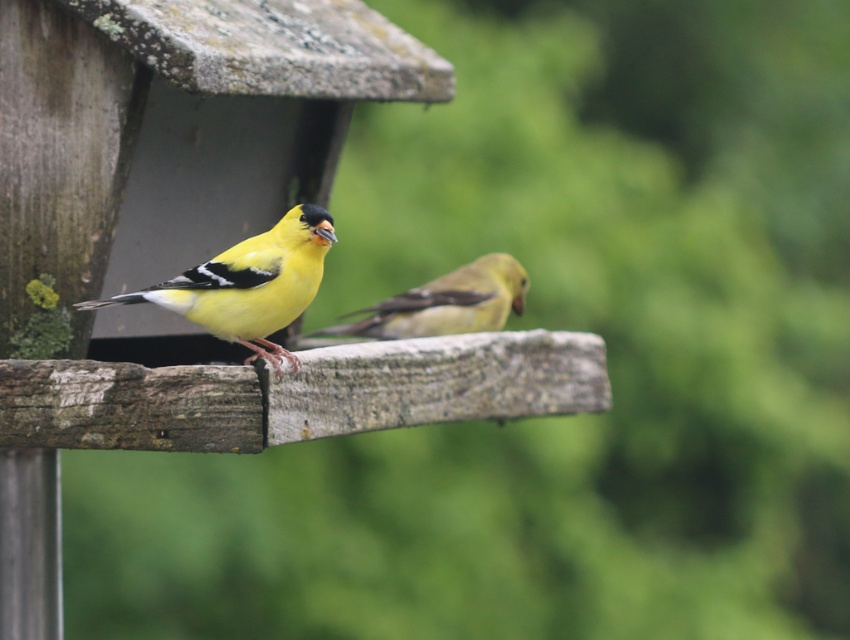
You are a birdwatcher observing the two birds at the wooden structure. The first bird is at point (259, 234) and the second bird is at point (482, 310). Which bird is closer to you?

The bird at point (259, 234) is closer to you because it is in front of the bird at point (482, 310).